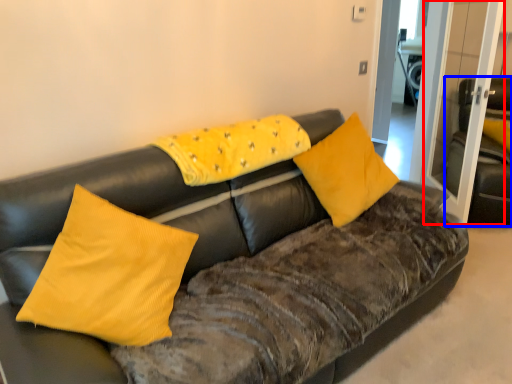
Question: Which of the following is the closest to the observer, glass door (highlighted by a red box) or armchair (highlighted by a blue box)?

Choices:
 (A) glass door
 (B) armchair

Answer: (A)